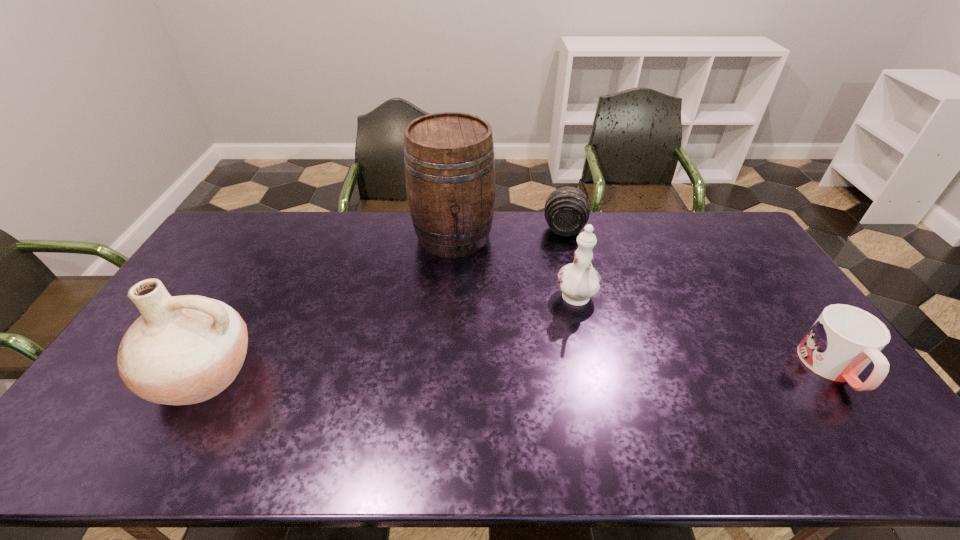
Locate an element on the screen. vacant area between the leftmost object and the cider is located at coordinates (328, 305).

This screenshot has height=540, width=960. Identify the location of empty space that is in between the cider and the leftmost object. (328, 305).

Locate an element on the screen. free spot between the leftmost object and the mug is located at coordinates (518, 372).

Locate an element on the screen. This screenshot has width=960, height=540. empty space that is in between the tallest object and the third farthest object is located at coordinates (516, 268).

Find the location of a particular element. vacant area that lies between the chinaware and the mug is located at coordinates (705, 334).

At what (x,y) coordinates should I click in order to perform the action: click on vacant space that is in between the pottery and the cider. Please return your answer as a coordinate pair (x, y). The image size is (960, 540). Looking at the image, I should click on (328, 305).

The height and width of the screenshot is (540, 960). In order to click on object that is the closest to the telephoto lens in this screenshot , I will do `click(449, 162)`.

Find the location of a particular element. the third closest object to the rightmost object is located at coordinates (449, 162).

At what (x,y) coordinates should I click in order to perform the action: click on vacant space that satisfies the following two spatial constraints: 1. on the back side of the telephoto lens; 2. on the right side of the third farthest object. Please return your answer as a coordinate pair (x, y). Looking at the image, I should click on (561, 230).